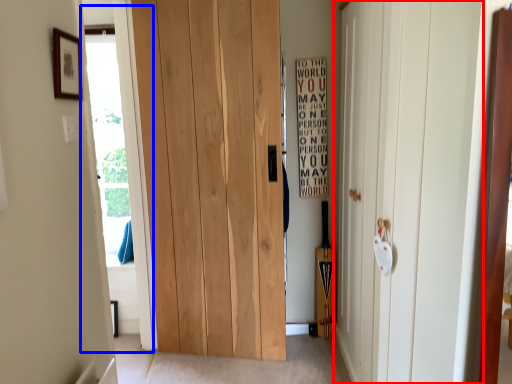
Question: Which point is further to the camera, door (highlighted by a red box) or glass door (highlighted by a blue box)?

Choices:
 (A) door
 (B) glass door

Answer: (B)